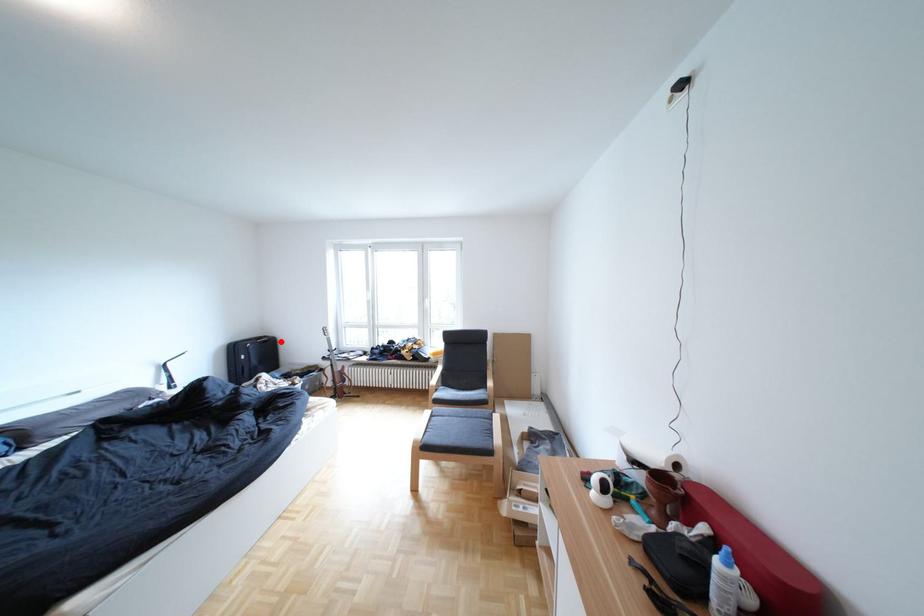
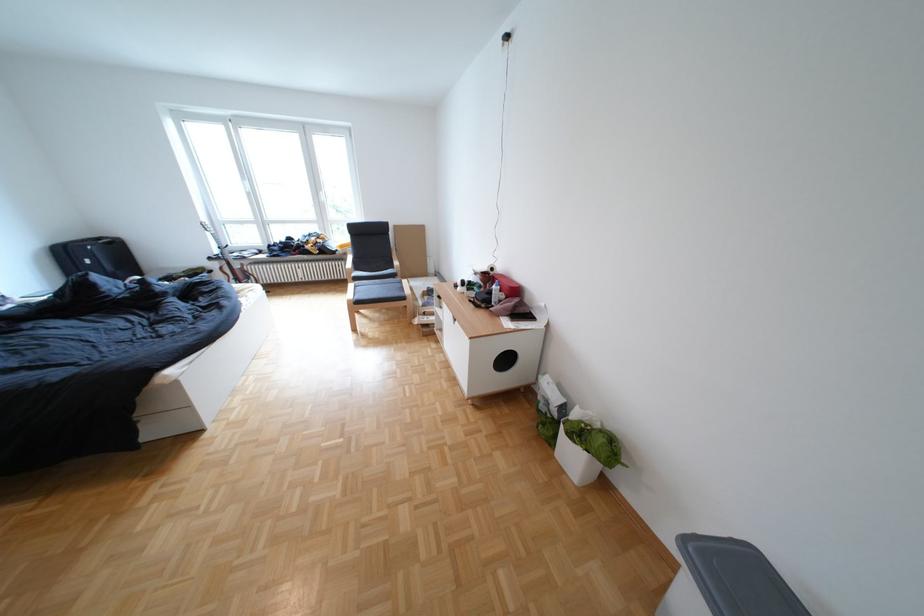
Locate, in the second image, the point that corresponds to the highlighted location in the first image.

(126, 244)